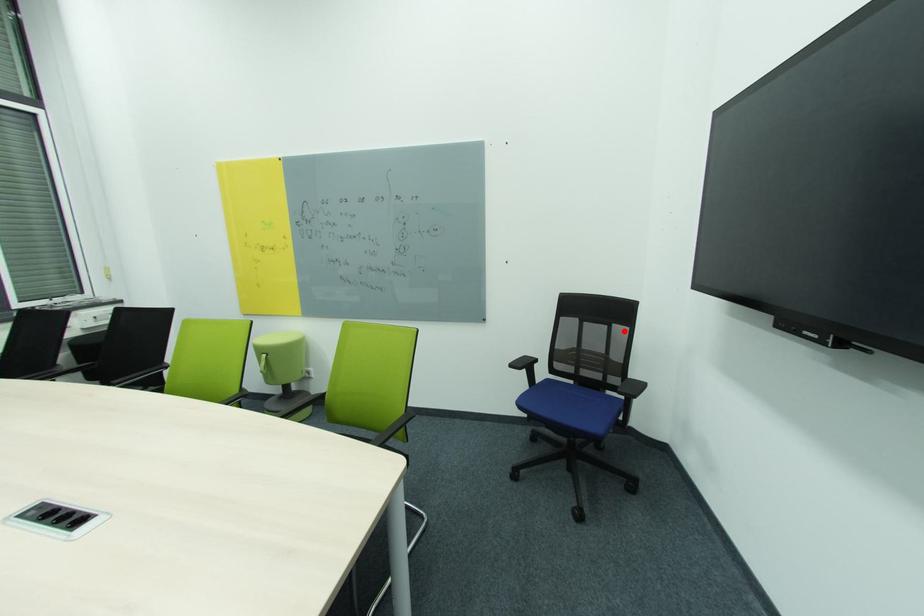
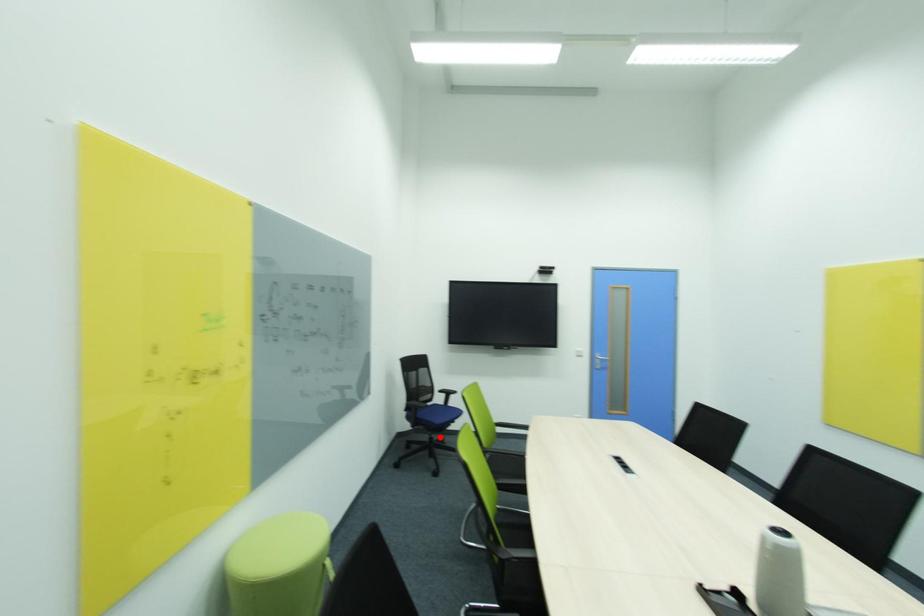
I am providing you with two images of the same scene from different viewpoints. A red point is marked on the first image and another point is marked on the second image. Is the marked point in image1 the same physical position as the marked point in image2?

No